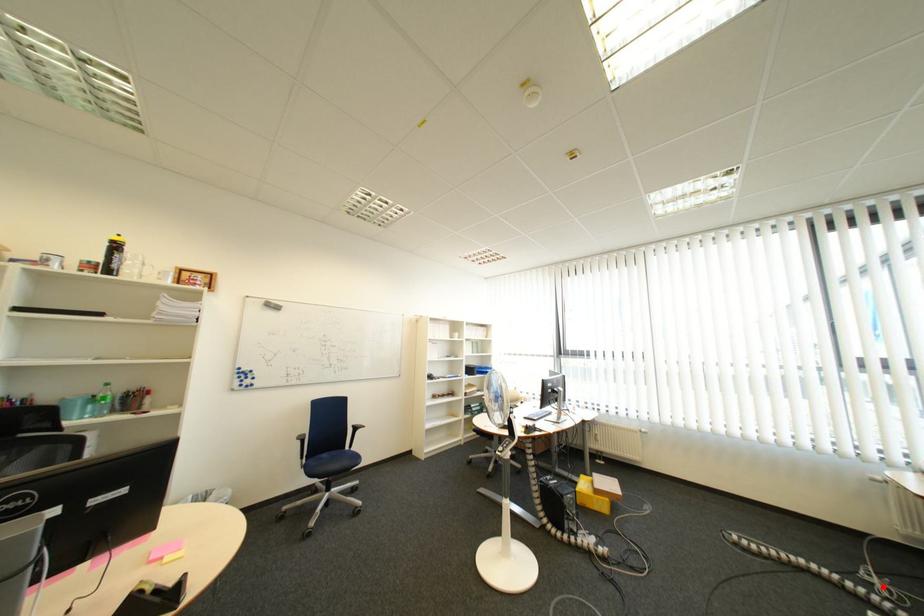
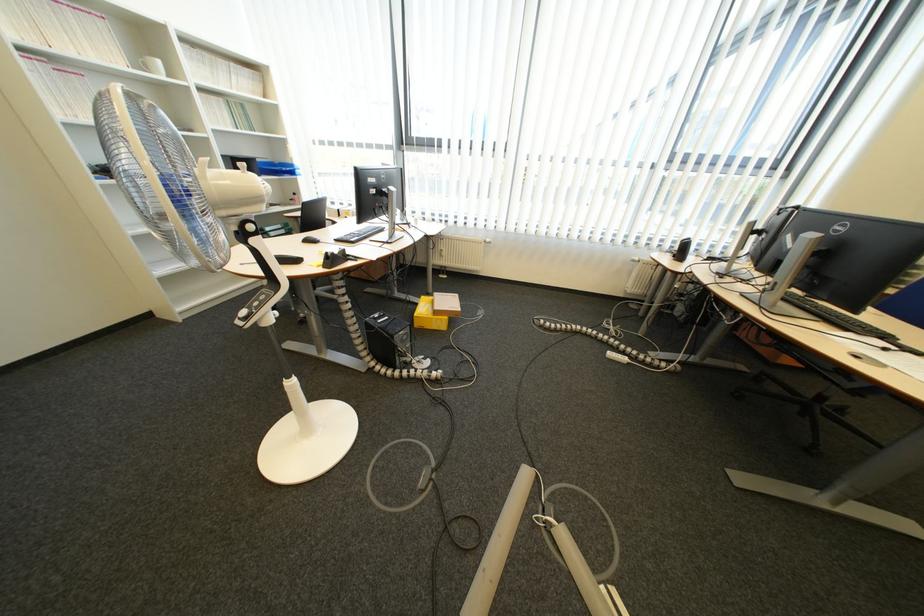
Locate, in the second image, the point that corresponds to the highlighted location in the first image.

(619, 331)